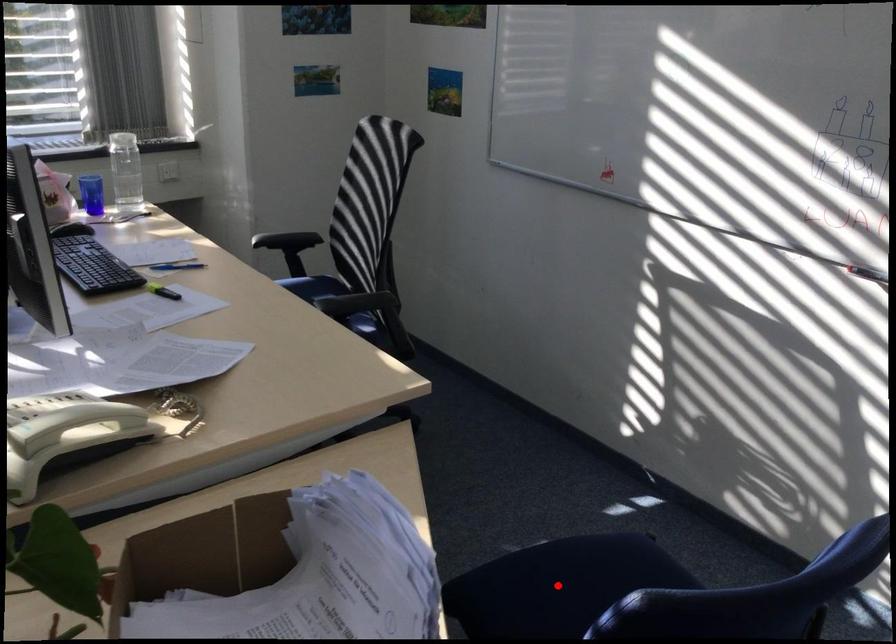
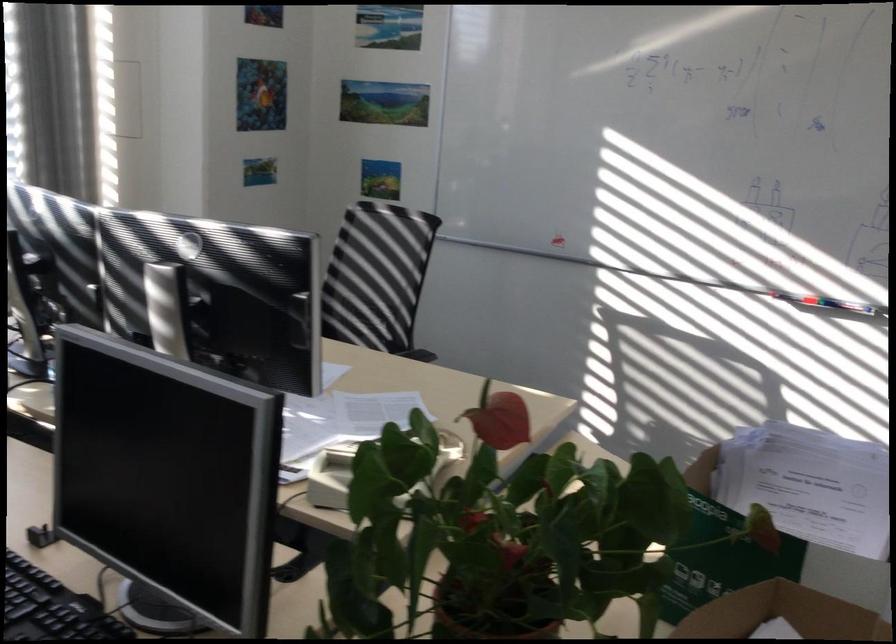
Question: I am providing you with two images of the same scene from different viewpoints. A red point is marked on the first image. Is the red point's position out of view in image 2?

Choices:
 (A) Yes
 (B) No

Answer: (A)